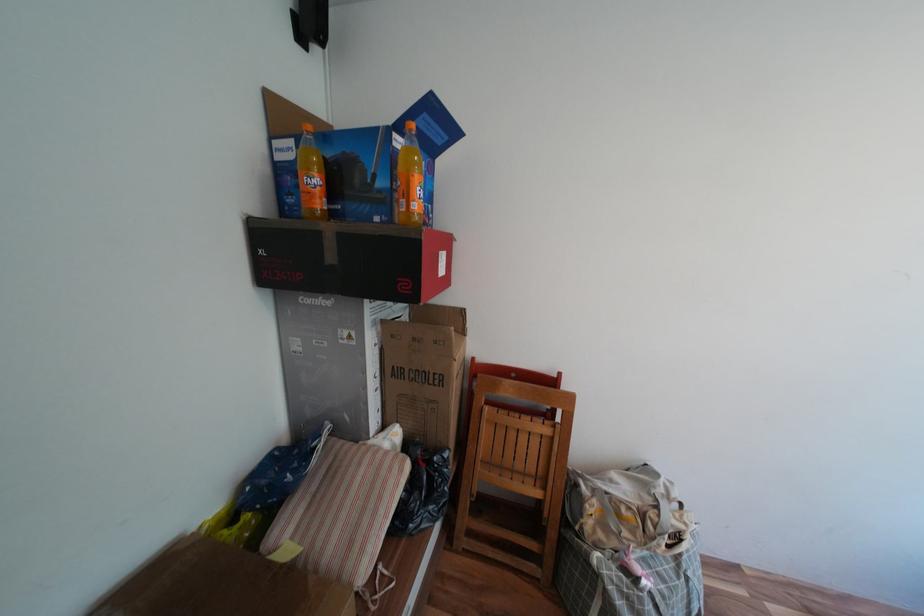
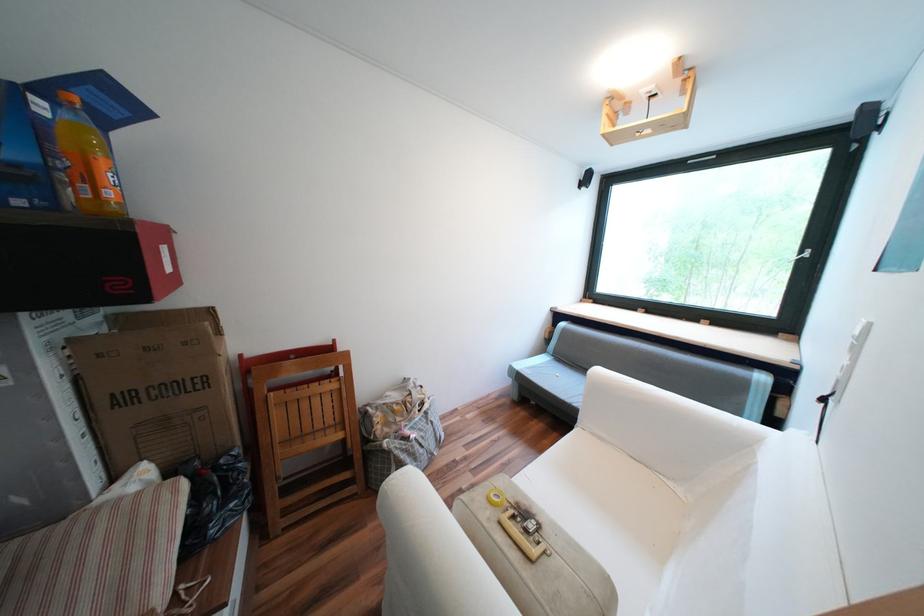
Locate, in the second image, the point that corresponds to the point at 596,506 in the first image.

(383, 419)